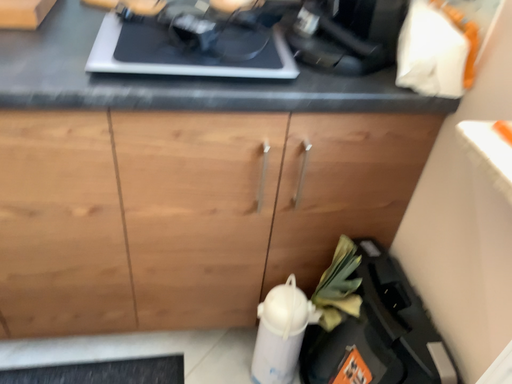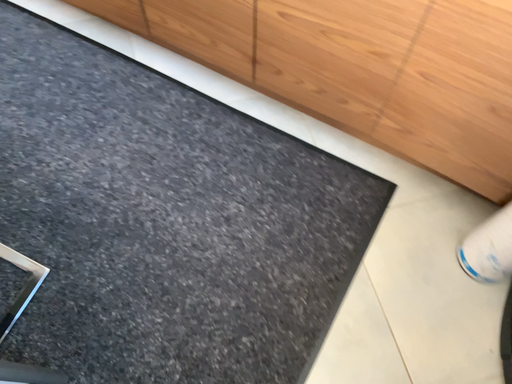
Question: How did the camera likely rotate when shooting the video?

Choices:
 (A) rotated right
 (B) rotated left

Answer: (B)